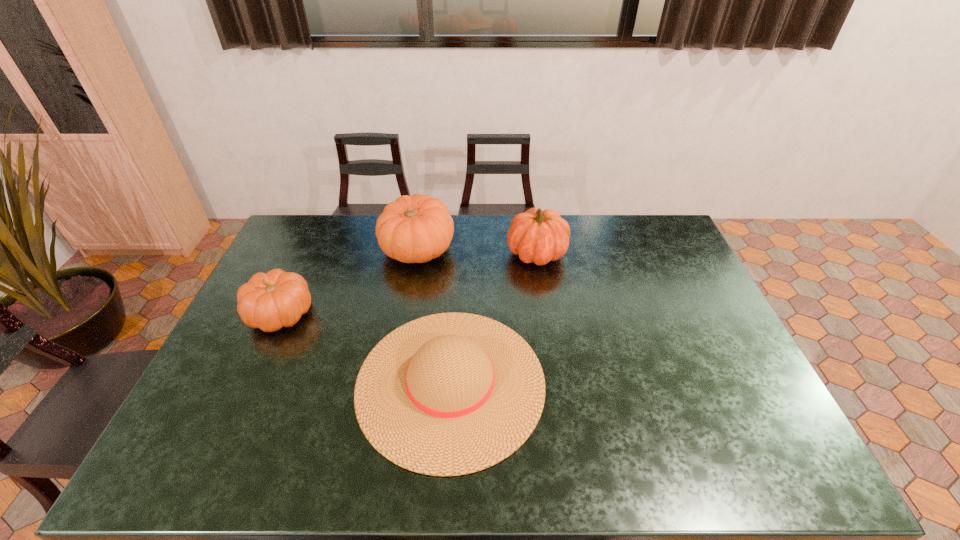
I want to click on free space that is in between the bonnet and the rightmost pumpkin, so click(x=493, y=318).

Find the location of a particular element. The image size is (960, 540). object that is the third closest to the second pumpkin from right to left is located at coordinates (448, 394).

Identify which object is the second nearest to the shortest pumpkin. Please provide its 2D coordinates. Your answer should be formatted as a tuple, i.e. [(x, y)], where the tuple contains the x and y coordinates of a point satisfying the conditions above.

[(448, 394)]

Image resolution: width=960 pixels, height=540 pixels. Identify the location of pumpkin that stands as the second closest to the rightmost pumpkin. (277, 299).

Where is `the closest pumpkin to the rightmost pumpkin`? Image resolution: width=960 pixels, height=540 pixels. the closest pumpkin to the rightmost pumpkin is located at coordinates (414, 229).

Locate an element on the screen. This screenshot has width=960, height=540. vacant region that satisfies the following two spatial constraints: 1. on the back side of the shortest pumpkin; 2. on the left side of the second pumpkin from right to left is located at coordinates (310, 248).

This screenshot has width=960, height=540. I want to click on vacant area that satisfies the following two spatial constraints: 1. on the front side of the leftmost object; 2. on the left side of the bonnet, so click(x=249, y=383).

Where is `vacant space that satisfies the following two spatial constraints: 1. on the front side of the second pumpkin from right to left; 2. on the left side of the bonnet`? vacant space that satisfies the following two spatial constraints: 1. on the front side of the second pumpkin from right to left; 2. on the left side of the bonnet is located at coordinates (395, 383).

Where is `free space that satisfies the following two spatial constraints: 1. on the back side of the bonnet; 2. on the left side of the rightmost pumpkin`? This screenshot has height=540, width=960. free space that satisfies the following two spatial constraints: 1. on the back side of the bonnet; 2. on the left side of the rightmost pumpkin is located at coordinates (458, 253).